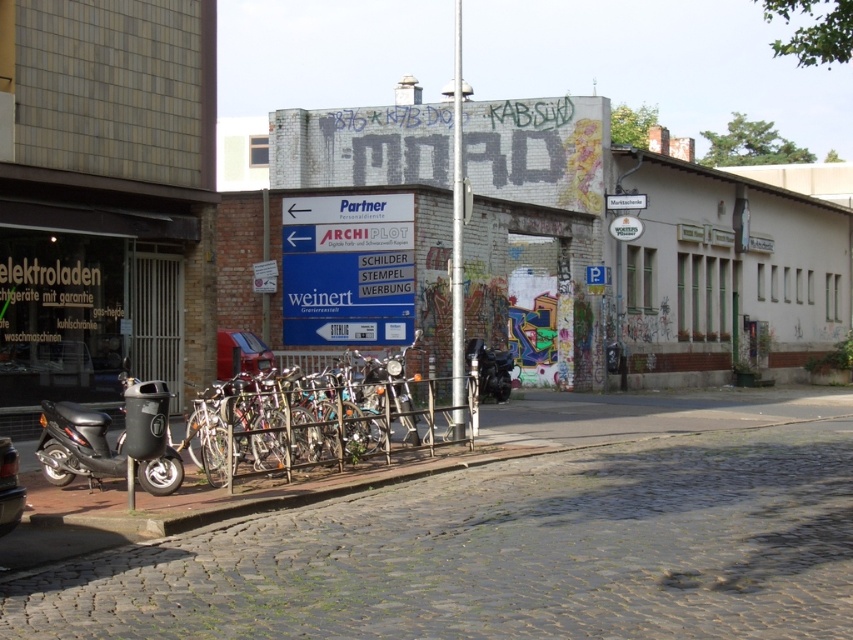
You are a delivery person who needs to park your small electric scooter between the shiny chrome motorcycle at center and the shiny black motorcycle at center. Is there enough space between them for your scooter?

The shiny chrome motorcycle at center occupies less space than shiny black motorcycle at center. Since the chrome motorcycle takes up less space, there might be enough room between them for your scooter, but it depends on the exact dimensions of the scooter.

You are standing at the entrance of the elektroladen store and want to reach the cobblestone pavement at lower center. According to the coordinates provided, in which direction should you walk to reach it?

The cobblestone pavement at lower center is located at coordinates point (517, 540). Since you are at the entrance of the elektroladen store, you should walk towards the lower center direction to reach it.

You are a delivery person trying to place a large box on the ground. You see the cobblestone pavement at lower center and the shiny metallic bicycles at center. Which surface can you place the box on without it tipping over?

The cobblestone pavement at lower center has a lesser height compared to the shiny metallic bicycles at center, so placing the box on the cobblestone pavement at lower center would be more stable and less likely to tip over.